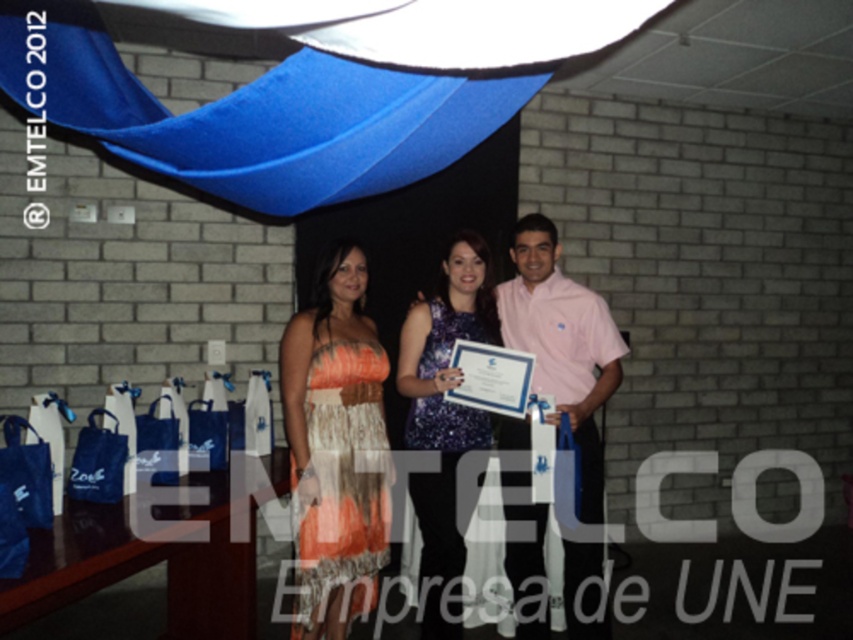
You are a photographer at the event and want to adjust the lighting so that both the pink cotton shirt at center and the shiny blue dress at center are equally illuminated. Given their positions relative to the light source, which one is closer to the light source?

The pink cotton shirt at center is to the right of the shiny blue dress at center, but their distance to the light source isn t specified in the description. Without information about their proximity to the light source, it s impossible to determine which one is closer.

You are a photographer at a formal event. You need to adjust the lighting so that both the pink cotton shirt at center and the shiny blue dress at center are evenly lit. The current setup has the light source above them. Given that the distance between them is 10.01 centimeters, can you estimate whether adjusting the light angle to cover both objects simultaneously is feasible?

The distance between the pink cotton shirt at center and the shiny blue dress at center is 10.01 centimeters, which is a relatively small gap. By adjusting the light angle slightly, it should be possible to ensure both objects receive even illumination without needing to move the light source significantly.

In the scene shown: You are a photographer at the event and need to adjust the lighting so that both the orange lace dress at center and the sparkly purple dress at center are equally visible. Given their height difference, which dress might require more adjustment to ensure proper exposure?

The orange lace dress at center is shorter than the sparkly purple dress at center, so the shorter orange lace dress at center may require more adjustment to ensure proper exposure since it is closer to the ground and might be in a shadowed area.